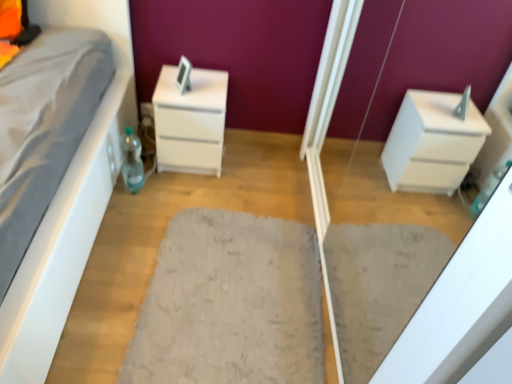
Image resolution: width=512 pixels, height=384 pixels. I want to click on free space above white glossy chest of drawers at center (from a real-world perspective), so (197, 84).